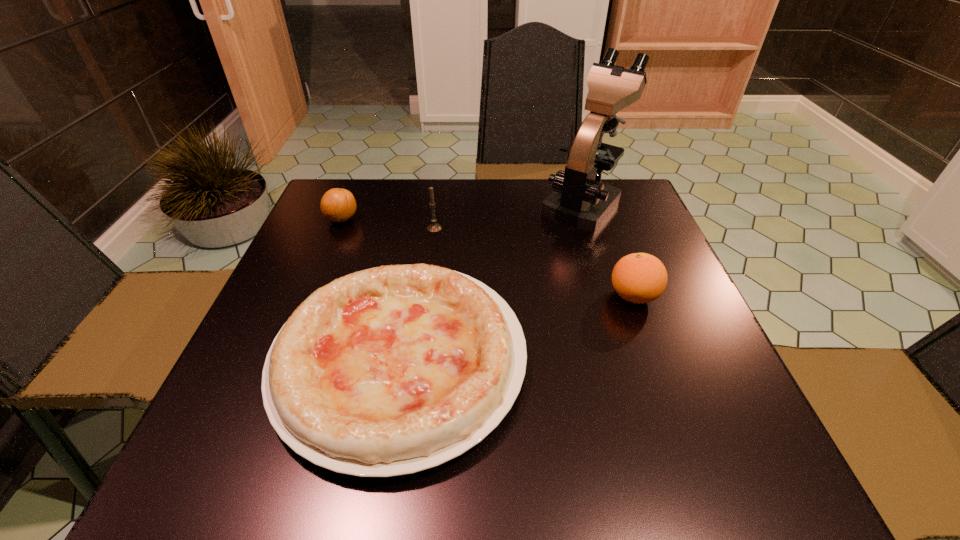
Where is `unoccupied position between the left orange and the nearer orange`? The image size is (960, 540). unoccupied position between the left orange and the nearer orange is located at coordinates (488, 258).

Where is `vacant space that's between the candle and the shorter orange`? This screenshot has height=540, width=960. vacant space that's between the candle and the shorter orange is located at coordinates (388, 224).

I want to click on free space between the tallest object and the candle, so click(x=509, y=216).

The height and width of the screenshot is (540, 960). In order to click on free spot between the farther orange and the third shortest object in this screenshot , I will do `click(488, 258)`.

Find the location of a particular element. This screenshot has width=960, height=540. empty location between the left orange and the taller orange is located at coordinates (488, 258).

Locate an element on the screen. This screenshot has width=960, height=540. empty location between the candle and the left orange is located at coordinates (388, 224).

Where is `vacant region between the shorter orange and the microscope`? The height and width of the screenshot is (540, 960). vacant region between the shorter orange and the microscope is located at coordinates (462, 212).

I want to click on empty space between the nearer orange and the microscope, so click(608, 250).

This screenshot has height=540, width=960. Find the location of `object that is the fourth closest one to the shorter orange`. object that is the fourth closest one to the shorter orange is located at coordinates (639, 278).

Find the location of `the second closest object to the right orange`. the second closest object to the right orange is located at coordinates (392, 370).